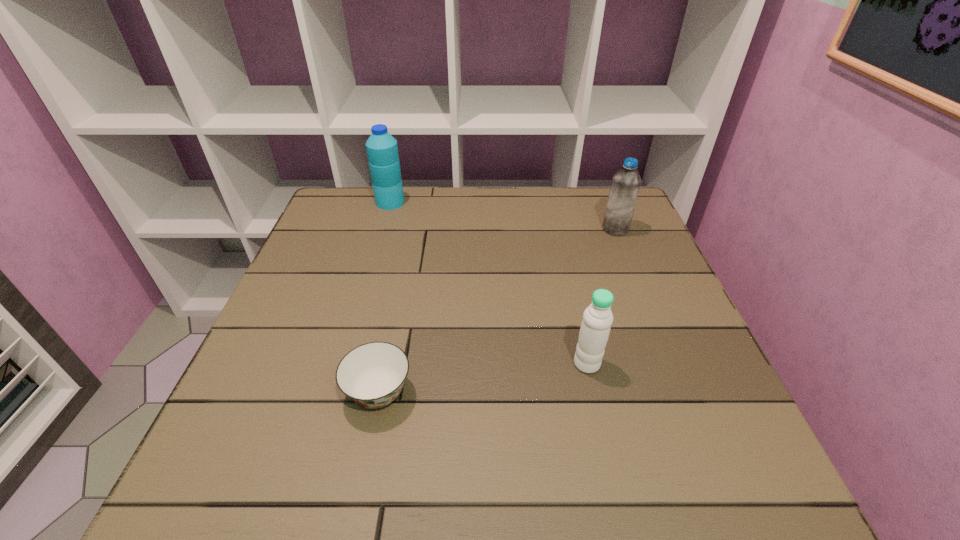
You are a GUI agent. You are given a task and a screenshot of the screen. Output one action in this format:
    pyautogui.click(x=<x>, y=<y>)
    Task: Click on the empty location between the nearest water bottle and the soup bowl
    
    Given the screenshot: What is the action you would take?
    pyautogui.click(x=483, y=378)

Find the location of a particular element. free space between the soup bowl and the rightmost object is located at coordinates (497, 311).

Find the location of a particular element. The image size is (960, 540). free space between the soup bowl and the second object from right to left is located at coordinates (483, 378).

Find the location of a particular element. This screenshot has width=960, height=540. vacant space that's between the second nearest water bottle and the farthest object is located at coordinates (503, 216).

I want to click on free space between the rightmost object and the leftmost water bottle, so click(x=503, y=216).

Locate an element on the screen. The height and width of the screenshot is (540, 960). free area in between the soup bowl and the rightmost object is located at coordinates (497, 311).

Identify the location of free space between the rightmost water bottle and the soup bowl. (497, 311).

Identify the location of free space between the rightmost object and the farthest object. Image resolution: width=960 pixels, height=540 pixels. (503, 216).

Where is `object that stands as the closest to the second farthest water bottle`? object that stands as the closest to the second farthest water bottle is located at coordinates (597, 318).

Where is `object that ranks as the second closest to the third object from left to right`? object that ranks as the second closest to the third object from left to right is located at coordinates (625, 185).